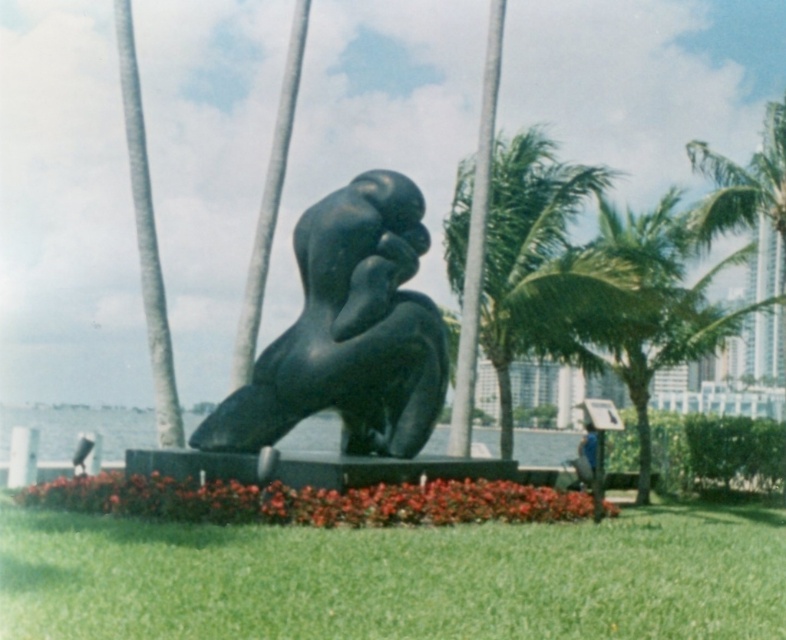
From the picture: Is green grass at center closer to the viewer compared to blue jeans at center?

That is True.

Can you confirm if green grass at center is positioned above blue jeans at center?

Correct, green grass at center is located above blue jeans at center.

Where is `green grass at center`? green grass at center is located at coordinates (x=395, y=577).

Does black polished statue at center appear on the left side of blue jeans at center?

Yes, black polished statue at center is to the left of blue jeans at center.

Between black polished statue at center and blue jeans at center, which one is positioned lower?

blue jeans at center is below.

I want to click on black polished statue at center, so [349, 332].

Which is in front, point (421, 388) or point (744, 314)?

Point (421, 388)

Can you confirm if black polished statue at center is taller than green leafy palm tree at right?

No, black polished statue at center is not taller than green leafy palm tree at right.

Find the location of a particular element. black polished statue at center is located at coordinates (349, 332).

Locate an element on the screen. black polished statue at center is located at coordinates (349, 332).